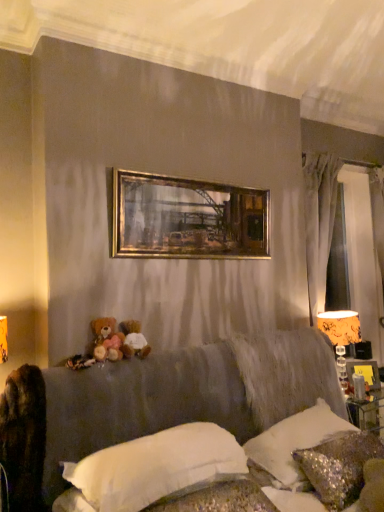
At what (x,y) coordinates should I click in order to perform the action: click on blank space situated above gold metallic picture frame at upper center (from a real-world perspective). Please return your answer as a coordinate pair (x, y). This screenshot has width=384, height=512. Looking at the image, I should click on (197, 178).